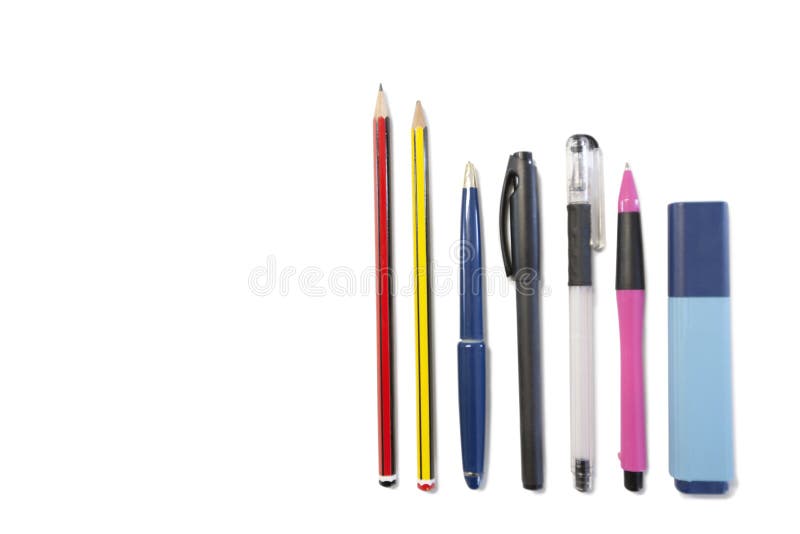
Where is `pens/pencils/highlighter`? pens/pencils/highlighter is located at coordinates (381, 269), (421, 265), (469, 278), (522, 239), (586, 237), (626, 247), (698, 263).